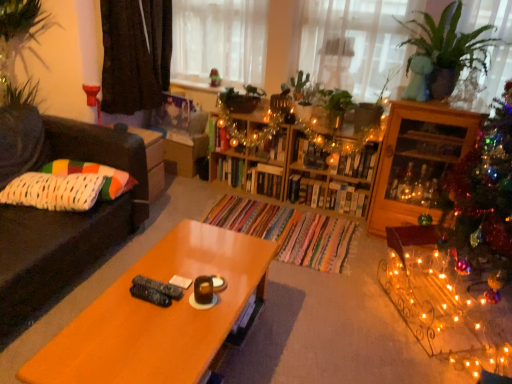
This screenshot has width=512, height=384. I want to click on vacant space in front of wooden bookshelf at center, arranged as the first shelf when viewed from the left, so click(x=245, y=208).